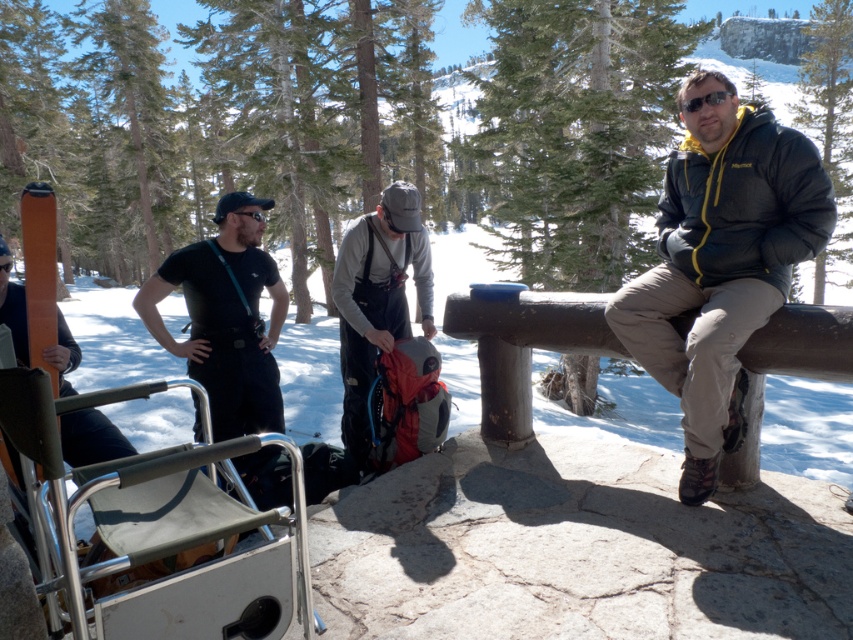
Question: Is matte black jacket at right bigger than gray fabric backpack at center?

Choices:
 (A) yes
 (B) no

Answer: (A)

Question: Among these points, which one is nearest to the camera?

Choices:
 (A) (190, 369)
 (B) (643, 278)
 (C) (396, 289)

Answer: (B)

Question: Which object is positioned closest to the matte black t-shirt at center?

Choices:
 (A) gray fabric backpack at center
 (B) matte black jacket at right

Answer: (A)

Question: Does matte black jacket at right have a lesser width compared to matte black t-shirt at center?

Choices:
 (A) no
 (B) yes

Answer: (B)

Question: Does matte black jacket at right appear on the right side of matte black t-shirt at center?

Choices:
 (A) yes
 (B) no

Answer: (A)

Question: Based on their relative distances, which object is farther from the matte black t-shirt at center?

Choices:
 (A) matte black jacket at right
 (B) gray fabric backpack at center

Answer: (A)